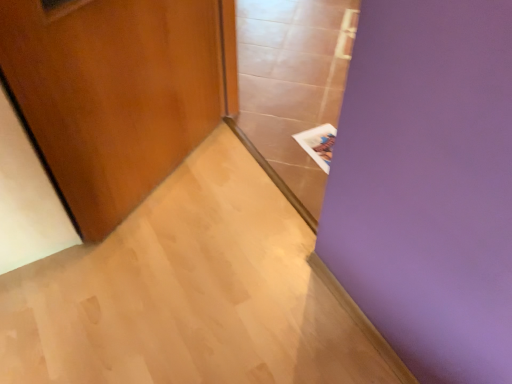
At what (x,y) coordinates should I click in order to perform the action: click on vacant space underneath transparent glass door at center (from a real-world perspective). Please return your answer as a coordinate pair (x, y). This screenshot has height=384, width=512. Looking at the image, I should click on (271, 160).